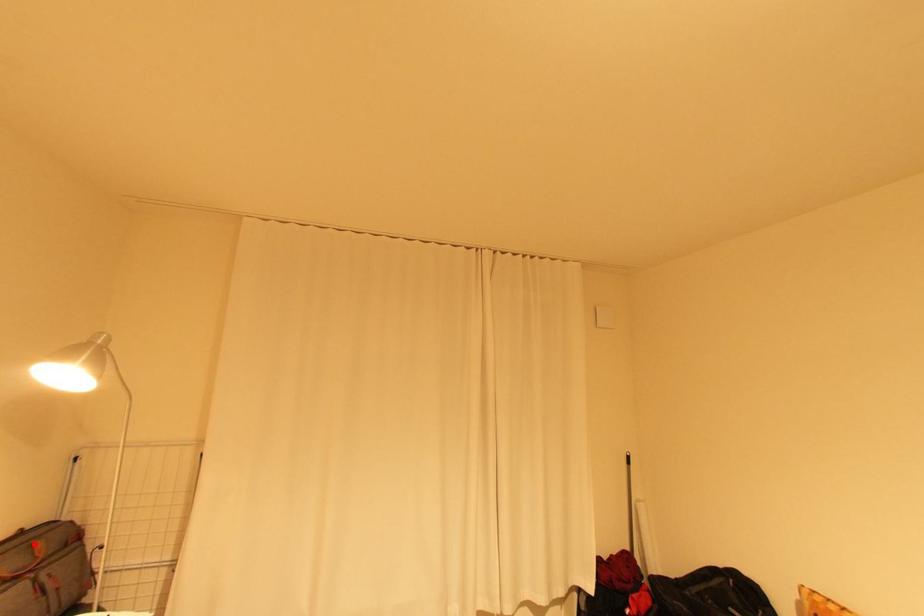
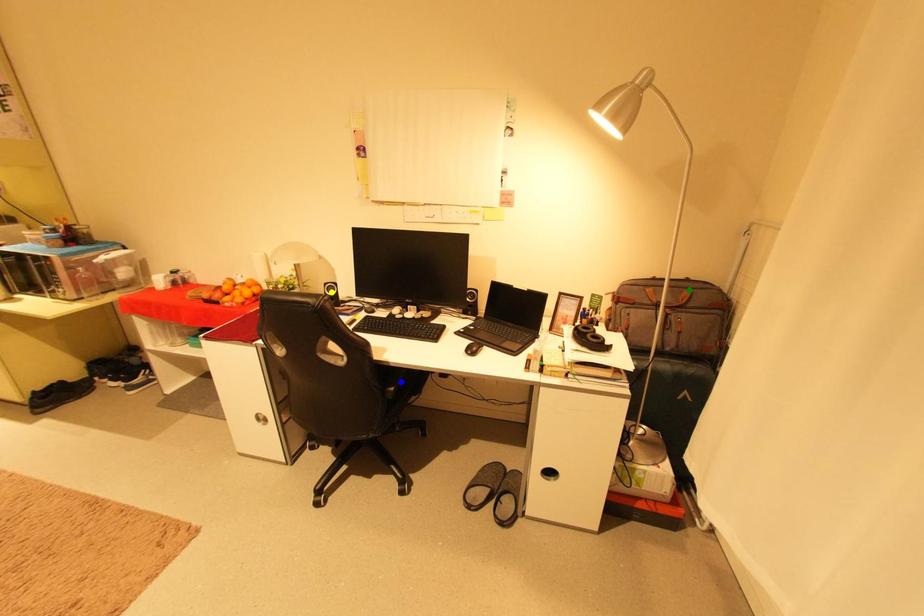
Question: I am providing you with two images of the same scene from different viewpoints. A red point is marked on the first image. You are given multiple points on the second image. Which spot in image 2 lines up with the point in image 1?

Choices:
 (A) green point
 (B) blue point
 (C) yellow point

Answer: (A)